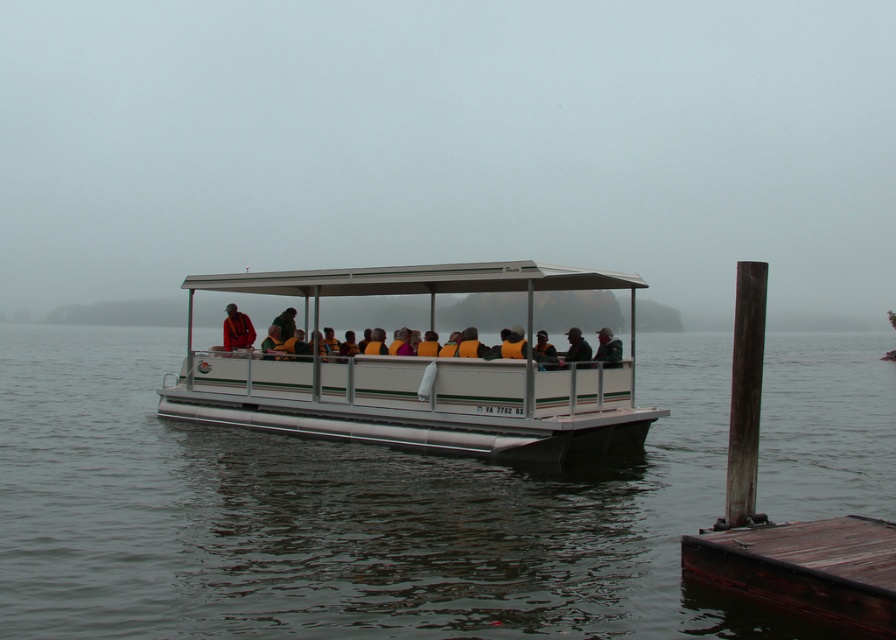
Question: Which object is the closest to the dark green jacket at center?

Choices:
 (A) matte orange life vest at center
 (B) white metallic boat at center

Answer: (B)

Question: Which is farther from the white metallic boat at center?

Choices:
 (A) clear water at center
 (B) dark brown wooden dock at lower right
 (C) dark gray fabric jacket at center

Answer: (A)

Question: Which point is farther to the camera?

Choices:
 (A) (764, 561)
 (B) (99, 484)
 (C) (576, 339)

Answer: (C)

Question: Does white metallic boat at center have a lesser width compared to dark gray fabric jacket at center?

Choices:
 (A) yes
 (B) no

Answer: (B)

Question: Is matte orange life vest at center thinner than dark gray fabric jacket at center?

Choices:
 (A) no
 (B) yes

Answer: (A)

Question: Does clear water at center appear under red fabric jacket at center?

Choices:
 (A) yes
 (B) no

Answer: (A)